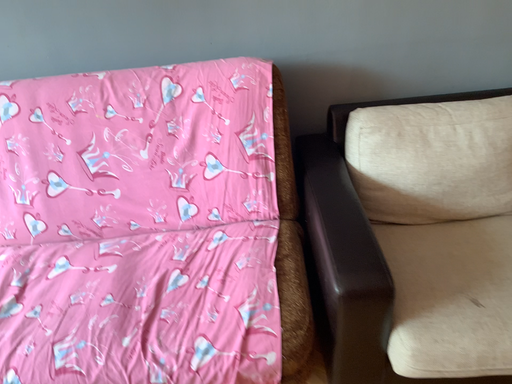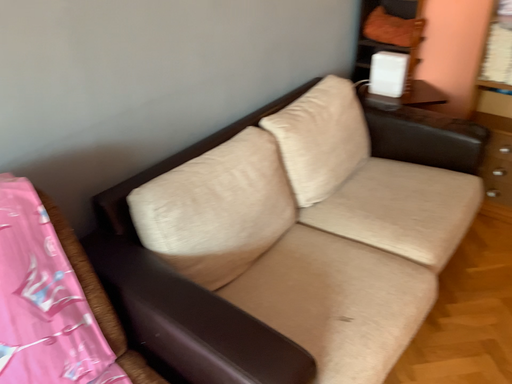
Question: Which way did the camera rotate in the video?

Choices:
 (A) rotated upward
 (B) rotated downward

Answer: (A)